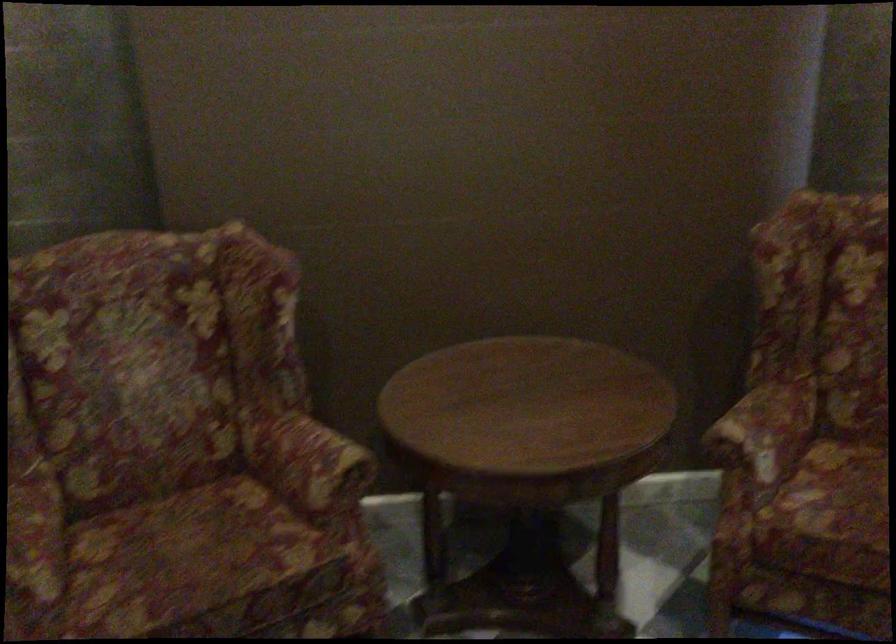
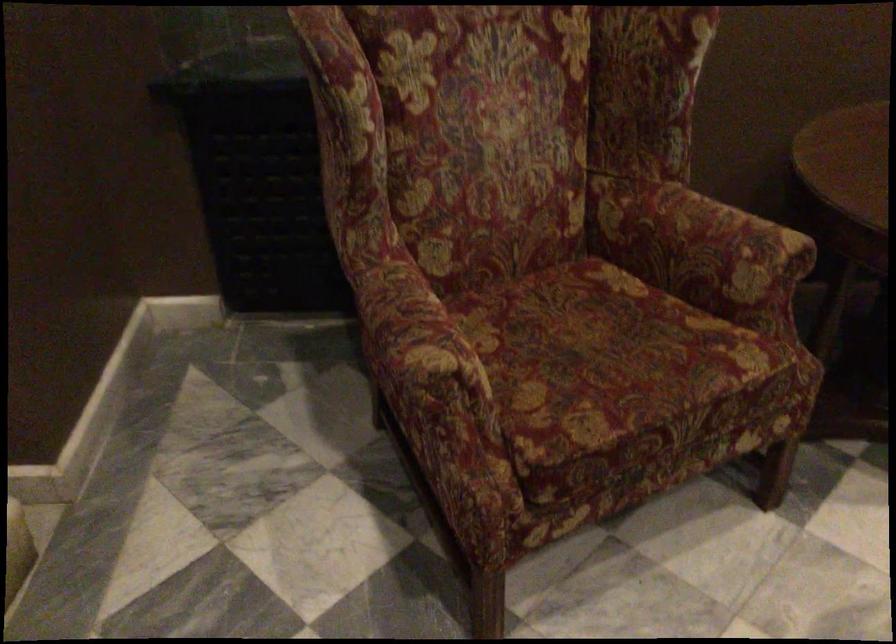
Locate, in the second image, the point that corresponds to point 186,564 in the first image.

(606, 361)